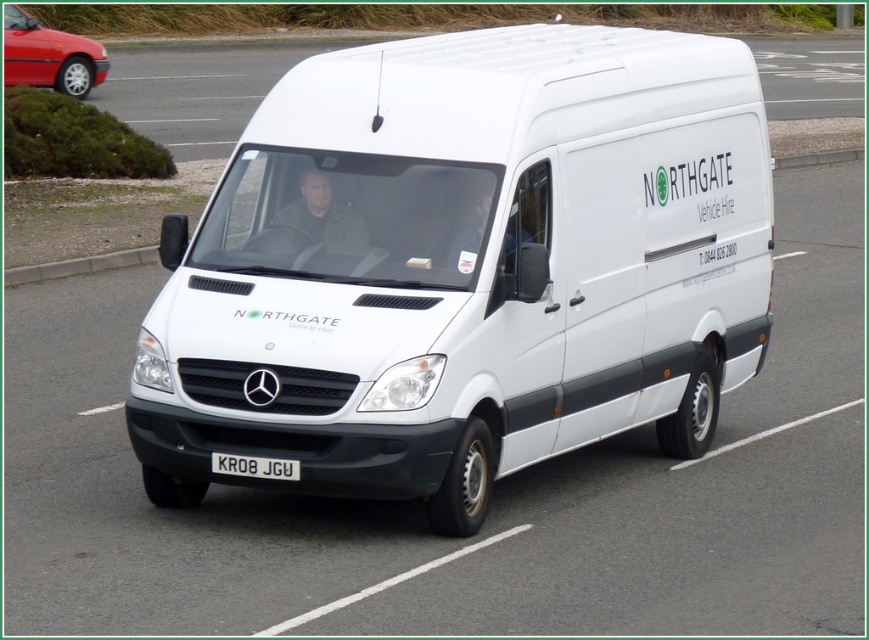
Question: Is gray concrete curb at lower left wider than white metallic license plate at center?

Choices:
 (A) no
 (B) yes

Answer: (B)

Question: Which of the following is the farthest from the observer?

Choices:
 (A) white metallic license plate at center
 (B) metallic red car at upper left
 (C) gray concrete curb at lower left

Answer: (B)

Question: Can you confirm if white matte van at center is positioned to the right of metallic red car at upper left?

Choices:
 (A) no
 (B) yes

Answer: (B)

Question: Which object is the farthest from the white matte van at center?

Choices:
 (A) gray concrete curb at lower left
 (B) white metallic license plate at center
 (C) metallic red car at upper left

Answer: (C)

Question: Can you confirm if white matte van at center is positioned to the left of metallic red car at upper left?

Choices:
 (A) yes
 (B) no

Answer: (B)

Question: Which point is farther to the camera?

Choices:
 (A) white matte van at center
 (B) gray concrete curb at lower left
 (C) metallic red car at upper left
 (D) white metallic license plate at center

Answer: (C)